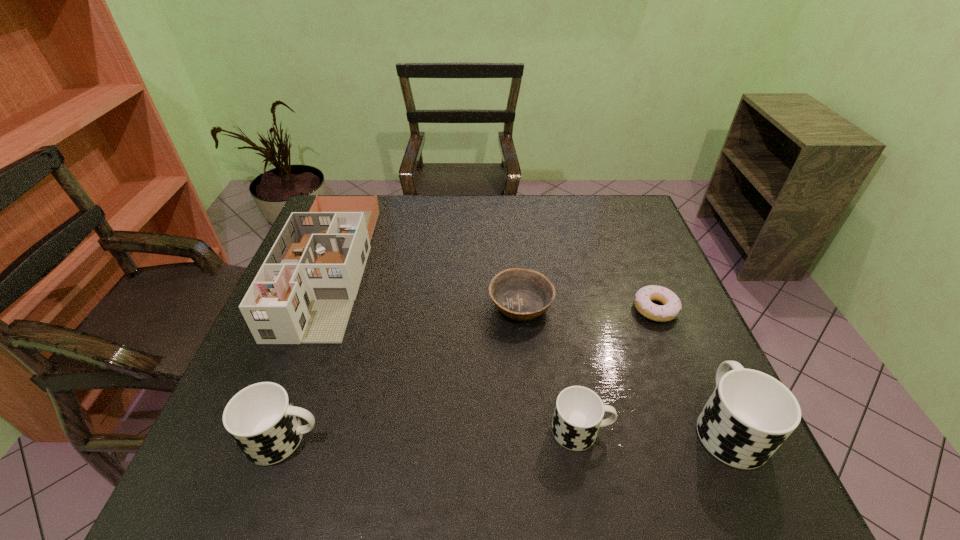
Identify the location of the leftmost cup. The image size is (960, 540). (261, 419).

The height and width of the screenshot is (540, 960). I want to click on the shortest cup, so [x=579, y=411].

The height and width of the screenshot is (540, 960). I want to click on the fourth tallest object, so click(579, 411).

Image resolution: width=960 pixels, height=540 pixels. I want to click on the rightmost cup, so click(x=749, y=415).

Where is `dollhouse`? dollhouse is located at coordinates (304, 291).

In order to click on the second shortest object in this screenshot , I will do `click(520, 294)`.

Find the location of a particular element. This screenshot has width=960, height=540. the shortest object is located at coordinates (671, 306).

You are a GUI agent. You are given a task and a screenshot of the screen. Output one action in this format:
    pyautogui.click(x=<x>, y=<y>)
    Task: Click on the vacant area situated 0.220m on the side of the leftmost cup with the handle
    
    Given the screenshot: What is the action you would take?
    pyautogui.click(x=433, y=439)

Locate an element on the screen. The height and width of the screenshot is (540, 960). vacant area located 0.270m on the side of the third shortest object with the handle is located at coordinates (746, 430).

The height and width of the screenshot is (540, 960). I want to click on free region located 0.390m on the side of the rightmost cup with the handle, so click(657, 271).